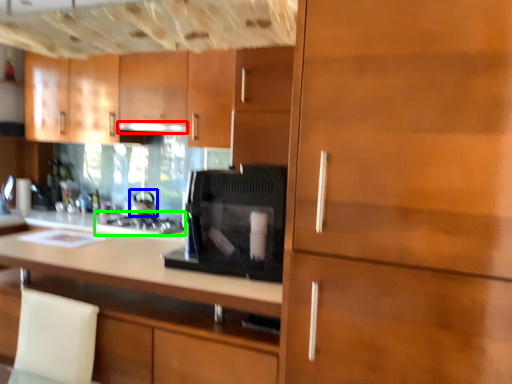
Question: Which object is the farthest from exhaust hood (highlighted by a red box)? Choose among these: appliance (highlighted by a blue box) or kitchen appliance (highlighted by a green box).

Choices:
 (A) appliance
 (B) kitchen appliance

Answer: (B)